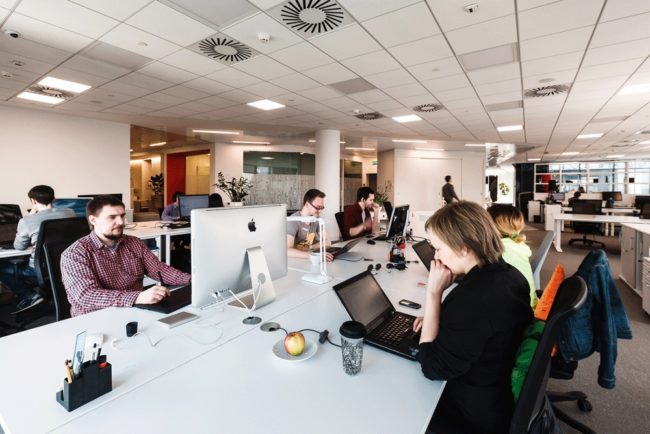
The height and width of the screenshot is (434, 650). I want to click on chairs, so click(49, 257), click(53, 229), click(8, 213), click(341, 219), click(564, 315), click(590, 272), click(543, 246), click(592, 227).